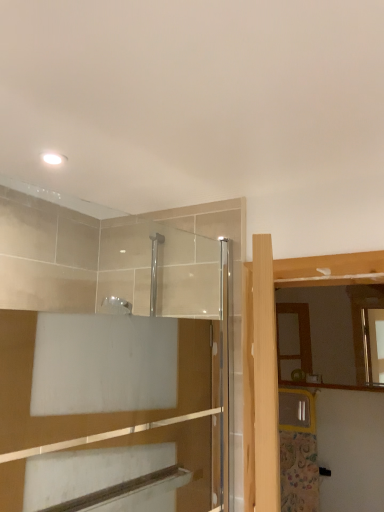
Question: Considering their positions, is clear glass shower door at upper center located in front of or behind matte wooden mirror at right?

Choices:
 (A) behind
 (B) front

Answer: (B)

Question: Is clear glass shower door at upper center inside or outside of matte wooden mirror at right?

Choices:
 (A) outside
 (B) inside

Answer: (A)

Question: Is clear glass shower door at upper center to the left or to the right of matte wooden mirror at right in the image?

Choices:
 (A) right
 (B) left

Answer: (B)

Question: Is matte wooden mirror at right spatially inside clear glass shower door at upper center, or outside of it?

Choices:
 (A) inside
 (B) outside

Answer: (B)

Question: Considering the positions of matte wooden mirror at right and clear glass shower door at upper center in the image, is matte wooden mirror at right taller or shorter than clear glass shower door at upper center?

Choices:
 (A) short
 (B) tall

Answer: (A)

Question: Does point (334, 351) appear closer or farther from the camera than point (173, 208)?

Choices:
 (A) closer
 (B) farther

Answer: (B)

Question: In the image, is matte wooden mirror at right positioned in front of or behind clear glass shower door at upper center?

Choices:
 (A) front
 (B) behind

Answer: (B)